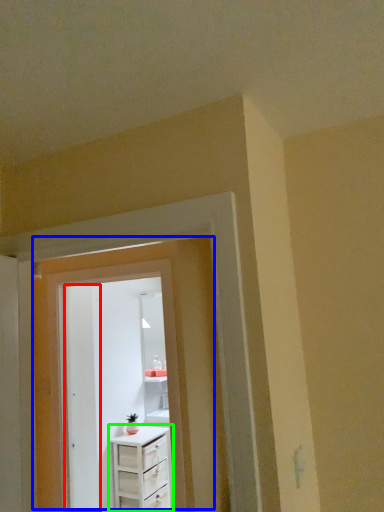
Question: Which object is the farthest from door (highlighted by a red box)? Choose among these: door (highlighted by a blue box) or chest of drawers (highlighted by a green box).

Choices:
 (A) door
 (B) chest of drawers

Answer: (A)